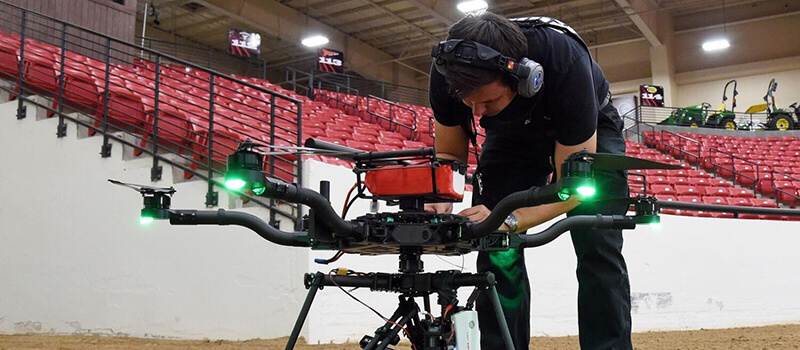
You are a GUI agent. You are given a task and a screenshot of the screen. Output one action in this format:
    pyautogui.click(x=<x>, y=<y>)
    Task: Click on the stand
    The width and height of the screenshot is (800, 350).
    Given the screenshot: What is the action you would take?
    pyautogui.click(x=394, y=275)